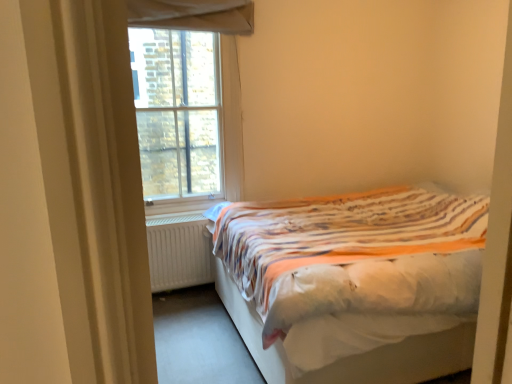
What is the approximate width of clear glass window at upper left?

clear glass window at upper left is 3.27 inches in width.

Find the location of a particular element. The image size is (512, 384). white matte radiator at lower left is located at coordinates (178, 251).

At what (x,y) coordinates should I click in order to perform the action: click on white fabric bed at right. Please return your answer as a coordinate pair (x, y). Looking at the image, I should click on (352, 281).

What are the coordinates of `radiator on the left of clear glass window at upper left` in the screenshot? It's located at (178, 251).

From the image's perspective, does white matte radiator at lower left appear lower than clear glass window at upper left?

Correct, white matte radiator at lower left appears lower than clear glass window at upper left in the image.

Which object is further away from the camera, white matte radiator at lower left or clear glass window at upper left?

white matte radiator at lower left is more distant.

Consider the image. Is clear glass window at upper left to the left of white fabric bed at right from the viewer's perspective?

Correct, you'll find clear glass window at upper left to the left of white fabric bed at right.

The width and height of the screenshot is (512, 384). In order to click on window on the left of white fabric bed at right in this screenshot , I will do `click(188, 101)`.

Does point (210, 104) come behind point (239, 210)?

Yes.

Is clear glass window at upper left far from white fabric bed at right?

Yes, clear glass window at upper left is far from white fabric bed at right.

Between white fabric bed at right and white matte radiator at lower left, which one has less height?

white matte radiator at lower left is shorter.

Is white matte radiator at lower left at the back of white fabric bed at right?

No.

Is white matte radiator at lower left a part of white fabric bed at right?

No, white matte radiator at lower left is not a part of white fabric bed at right.

How far apart are white fabric bed at right and white matte radiator at lower left?

white fabric bed at right is 89.33 centimeters from white matte radiator at lower left.

From the image's perspective, is white fabric bed at right positioned above or below clear glass window at upper left?

Based on their image positions, white fabric bed at right is located beneath clear glass window at upper left.

Which object is thinner, white fabric bed at right or clear glass window at upper left?

clear glass window at upper left.

From a real-world perspective, is white fabric bed at right on clear glass window at upper left?

No, from a real-world perspective, white fabric bed at right is not on top of clear glass window at upper left.

Is white fabric bed at right situated inside clear glass window at upper left or outside?

white fabric bed at right is outside clear glass window at upper left.

The image size is (512, 384). I want to click on window above the white matte radiator at lower left (from the image's perspective), so click(188, 101).

Is clear glass window at upper left outside of white matte radiator at lower left?

That's correct, clear glass window at upper left is outside of white matte radiator at lower left.

Does clear glass window at upper left have a lesser height compared to white matte radiator at lower left?

Incorrect, the height of clear glass window at upper left does not fall short of that of white matte radiator at lower left.

Does point (138, 5) come closer to viewer compared to point (164, 246)?

Yes, it is.

Between white matte radiator at lower left and white fabric bed at right, which one has larger size?

With larger size is white fabric bed at right.

Considering the sizes of objects white matte radiator at lower left and white fabric bed at right in the image provided, who is thinner, white matte radiator at lower left or white fabric bed at right?

Thinner between the two is white matte radiator at lower left.

You are a GUI agent. You are given a task and a screenshot of the screen. Output one action in this format:
    pyautogui.click(x=<x>, y=<y>)
    Task: Click on the radiator behind the clear glass window at upper left
    The image size is (512, 384).
    Given the screenshot: What is the action you would take?
    pyautogui.click(x=178, y=251)

The width and height of the screenshot is (512, 384). In order to click on bed lying in front of the clear glass window at upper left in this screenshot , I will do `click(352, 281)`.

Looking at the image, which one is located closer to white fabric bed at right, white matte radiator at lower left or clear glass window at upper left?

The object closer to white fabric bed at right is white matte radiator at lower left.

Based on their spatial positions, is white fabric bed at right or white matte radiator at lower left closer to clear glass window at upper left?

white matte radiator at lower left lies closer to clear glass window at upper left than the other object.

Which object lies nearer to the anchor point clear glass window at upper left, white matte radiator at lower left or white fabric bed at right?

Among the two, white matte radiator at lower left is located nearer to clear glass window at upper left.

When comparing their distances from white fabric bed at right, does clear glass window at upper left or white matte radiator at lower left seem closer?

Based on the image, white matte radiator at lower left appears to be nearer to white fabric bed at right.

From the image, which object appears to be farther from white matte radiator at lower left, white fabric bed at right or clear glass window at upper left?

white fabric bed at right.

Which object lies nearer to the anchor point white matte radiator at lower left, clear glass window at upper left or white fabric bed at right?

clear glass window at upper left is positioned closer to the anchor white matte radiator at lower left.

This screenshot has height=384, width=512. I want to click on window between white matte radiator at lower left and white fabric bed at right from left to right, so click(x=188, y=101).